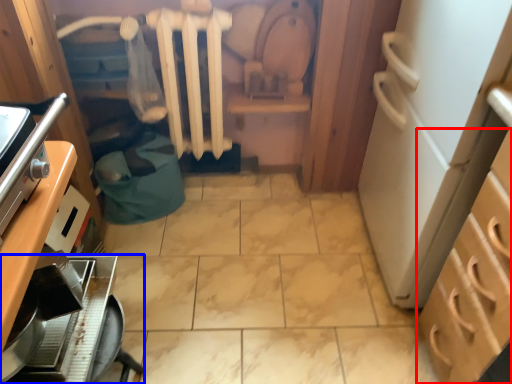
Question: Which object appears closest to the camera in this image, cabinetry (highlighted by a red box) or kitchen appliance (highlighted by a blue box)?

Choices:
 (A) cabinetry
 (B) kitchen appliance

Answer: (A)